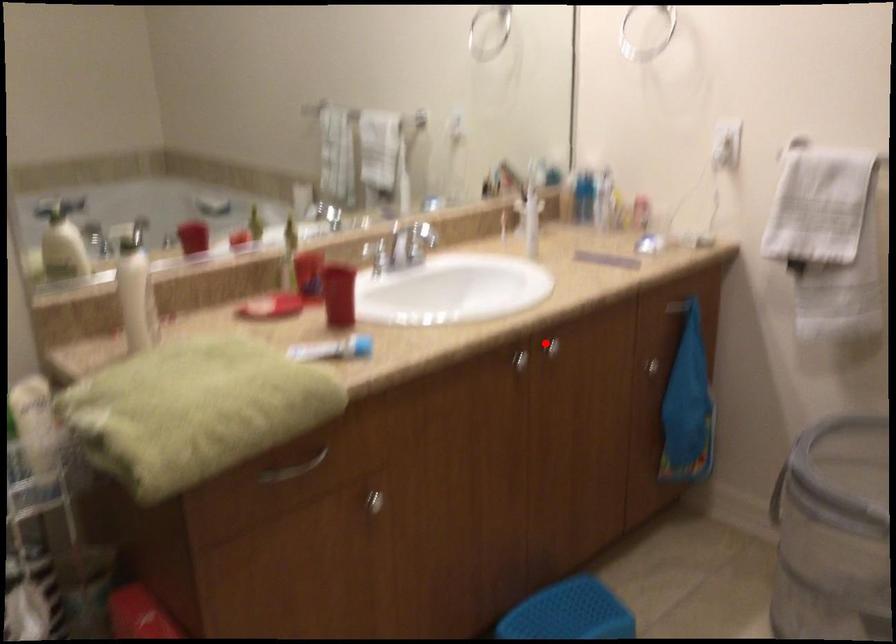
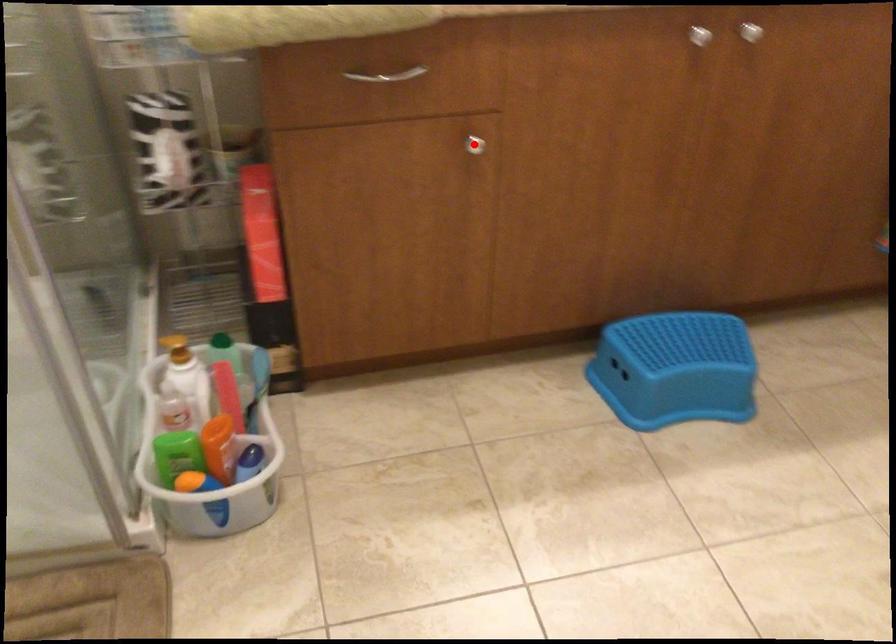
I am providing you with two images of the same scene from different viewpoints. A red point is marked on the first image and another point is marked on the second image. Does the point marked in image1 correspond to the same location as the one in image2?

No